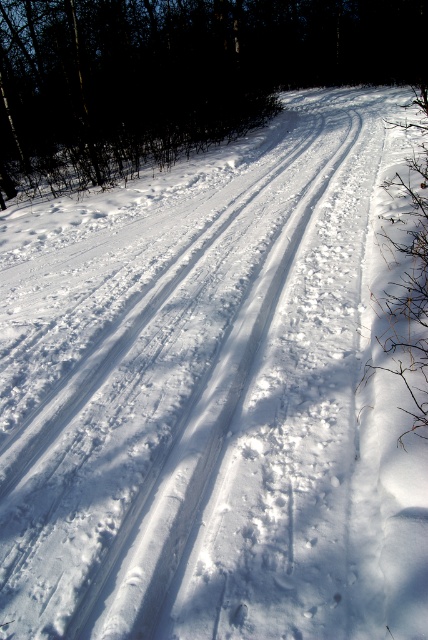
You are standing on a snowy trail and see two points marked on the image. The first point is at coordinates point (27, 100) and the second is at point (422, 106). Which point is closer to you?

Point (27, 100) is closer to you because it is further to the viewer than point (422, 106).

You are an outdoor photographer planning to capture the brown wood tree at upper left and the brown textured branch at right in a single frame. Based on their sizes, which object will appear bigger in your photo?

The brown wood tree at upper left will appear bigger in the photo because it has a larger size compared to the brown textured branch at right.